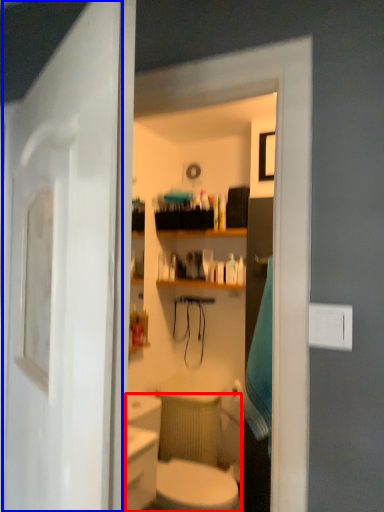
Question: Which point is further to the camera, sink (highlighted by a red box) or door (highlighted by a blue box)?

Choices:
 (A) sink
 (B) door

Answer: (A)